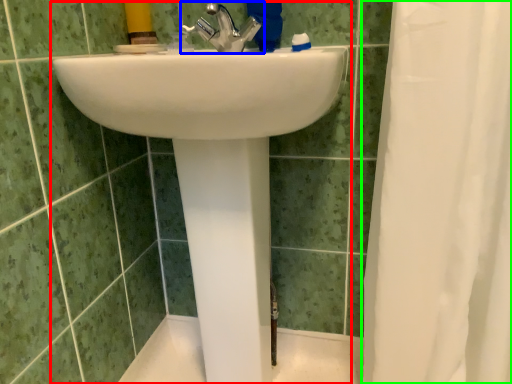
Question: Estimate the real-world distances between objects in this image. Which object is closer to sink (highlighted by a red box), tap (highlighted by a blue box) or shower curtain (highlighted by a green box)?

Choices:
 (A) tap
 (B) shower curtain

Answer: (B)